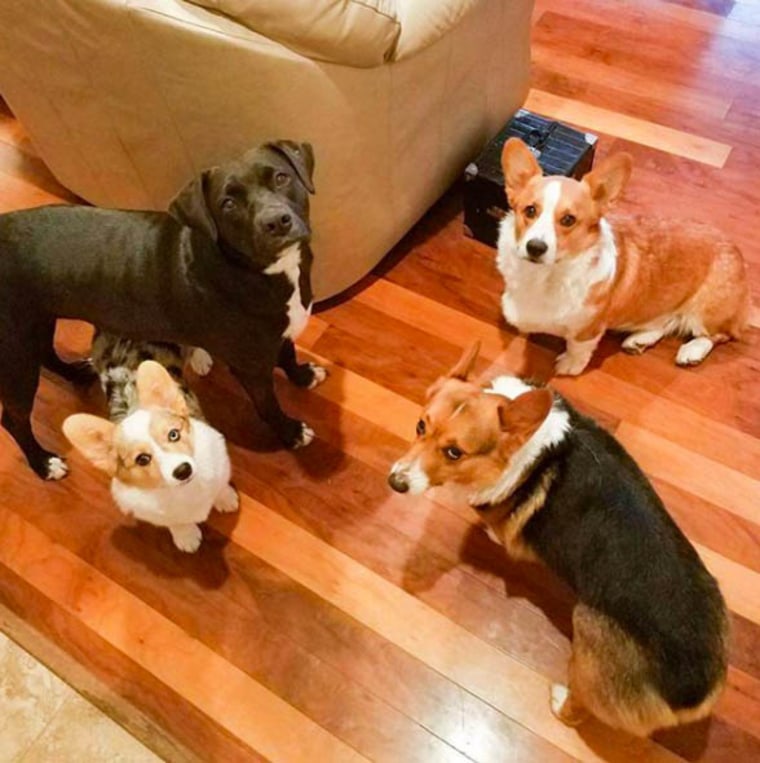
The height and width of the screenshot is (763, 760). I want to click on floor, so click(x=292, y=591).